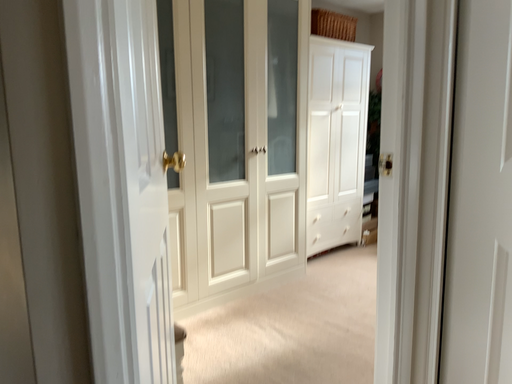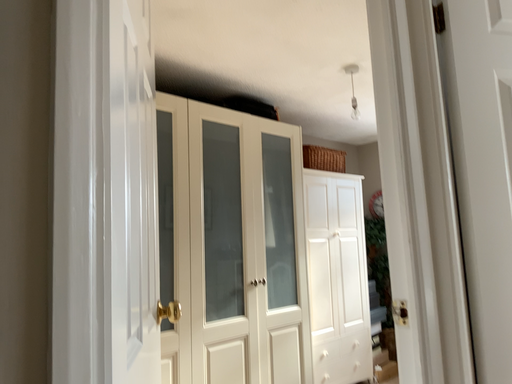
Question: How did the camera likely rotate when shooting the video?

Choices:
 (A) rotated upward
 (B) rotated downward

Answer: (A)